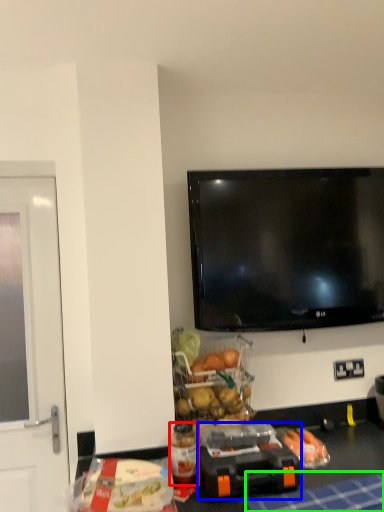
Question: Considering the real-world distances, which object is farthest from bottle (highlighted by a red box)? appliance (highlighted by a blue box) or tablecloth (highlighted by a green box)?

Choices:
 (A) appliance
 (B) tablecloth

Answer: (B)